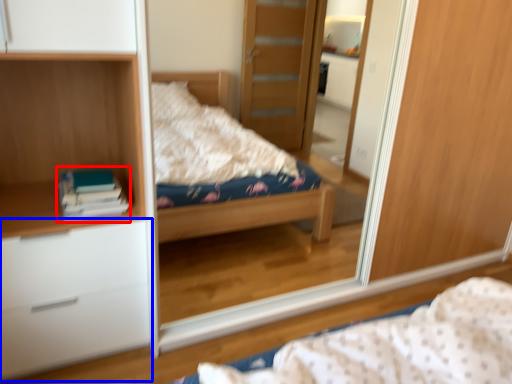
Question: Among these objects, which one is farthest to the camera, book (highlighted by a red box) or chest of drawers (highlighted by a blue box)?

Choices:
 (A) book
 (B) chest of drawers

Answer: (A)